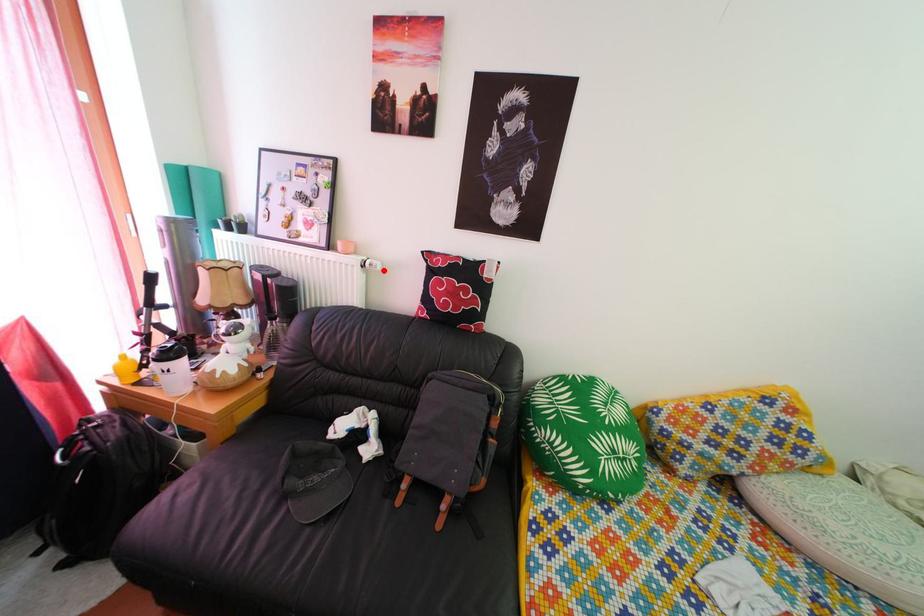
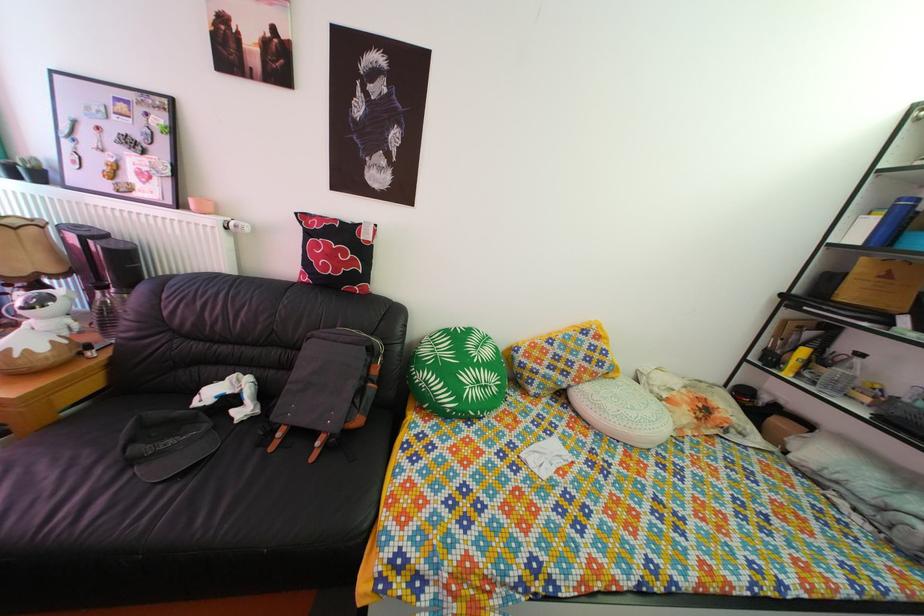
Locate, in the second image, the point that corresponds to the highlighted location in the first image.

(249, 232)